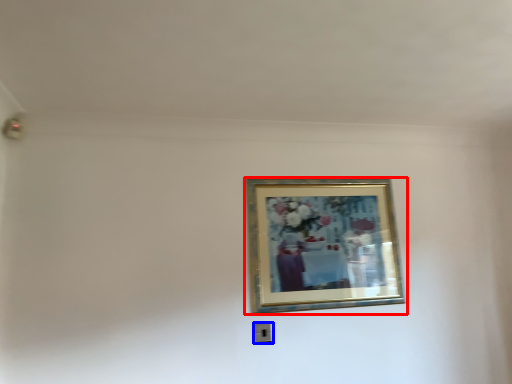
Question: Which object appears closest to the camera in this image, picture frame (highlighted by a red box) or electric outlet (highlighted by a blue box)?

Choices:
 (A) picture frame
 (B) electric outlet

Answer: (A)